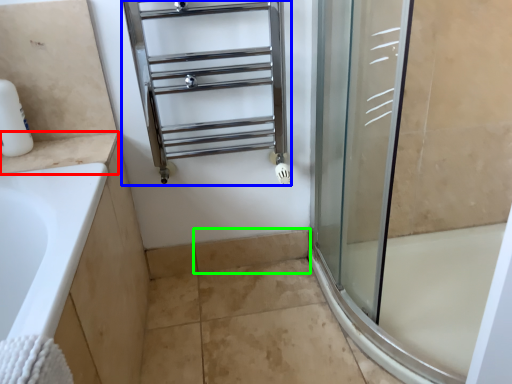
Question: Estimate the real-world distances between objects in this image. Which object is farther from counter top (highlighted by a red box), shelf (highlighted by a blue box) or tile (highlighted by a green box)?

Choices:
 (A) shelf
 (B) tile

Answer: (B)